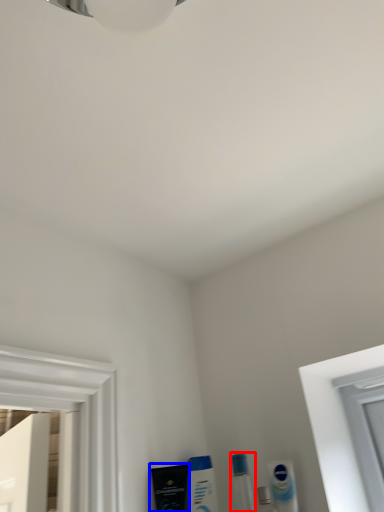
Question: Which object appears closest to the camera in this image, toiletry (highlighted by a red box) or mouthwash (highlighted by a blue box)?

Choices:
 (A) toiletry
 (B) mouthwash

Answer: (A)